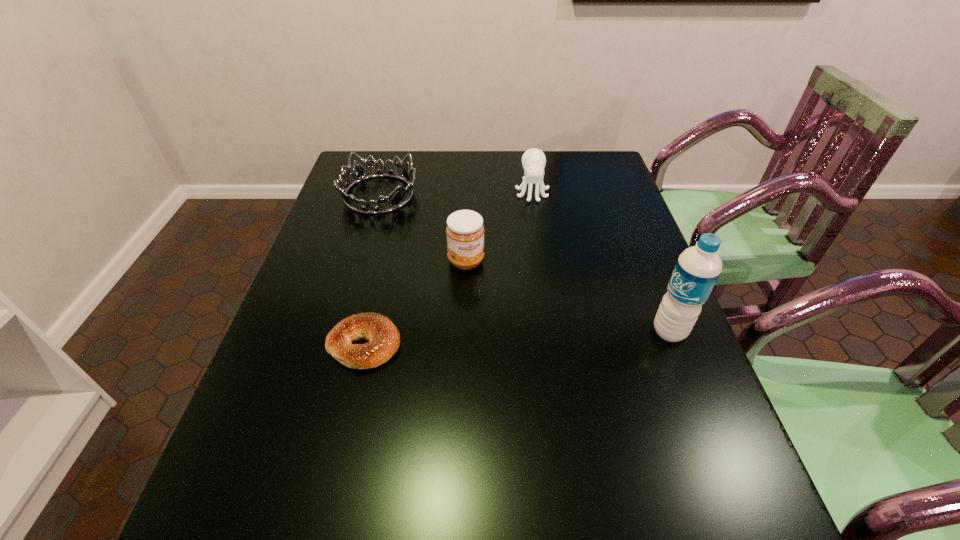
Where is `vacant region between the second shortest object and the rightmost object`? Image resolution: width=960 pixels, height=540 pixels. vacant region between the second shortest object and the rightmost object is located at coordinates [524, 263].

Find the location of a particular element. Image resolution: width=960 pixels, height=540 pixels. empty space that is in between the rightmost object and the shortest object is located at coordinates tap(516, 338).

The height and width of the screenshot is (540, 960). I want to click on vacant region between the fourth object from left to right and the second shortest object, so click(x=455, y=193).

Locate an element on the screen. vacant space that is in between the bagel and the jam is located at coordinates (416, 303).

Where is `object that stands as the fourth closest to the tiara`? The height and width of the screenshot is (540, 960). object that stands as the fourth closest to the tiara is located at coordinates (698, 268).

In order to click on object that ranks as the closest to the second object from right to left in this screenshot , I will do `click(465, 232)`.

I want to click on vacant space that satisfies the following two spatial constraints: 1. on the back side of the shortest object; 2. on the left side of the fourth object from left to right, so click(400, 192).

Locate an element on the screen. free space that satisfies the following two spatial constraints: 1. on the back side of the tiara; 2. on the right side of the octopus is located at coordinates (379, 192).

Where is `free region that satisfies the following two spatial constraints: 1. on the back side of the tallest object; 2. on the label of the bagel`? The height and width of the screenshot is (540, 960). free region that satisfies the following two spatial constraints: 1. on the back side of the tallest object; 2. on the label of the bagel is located at coordinates (368, 332).